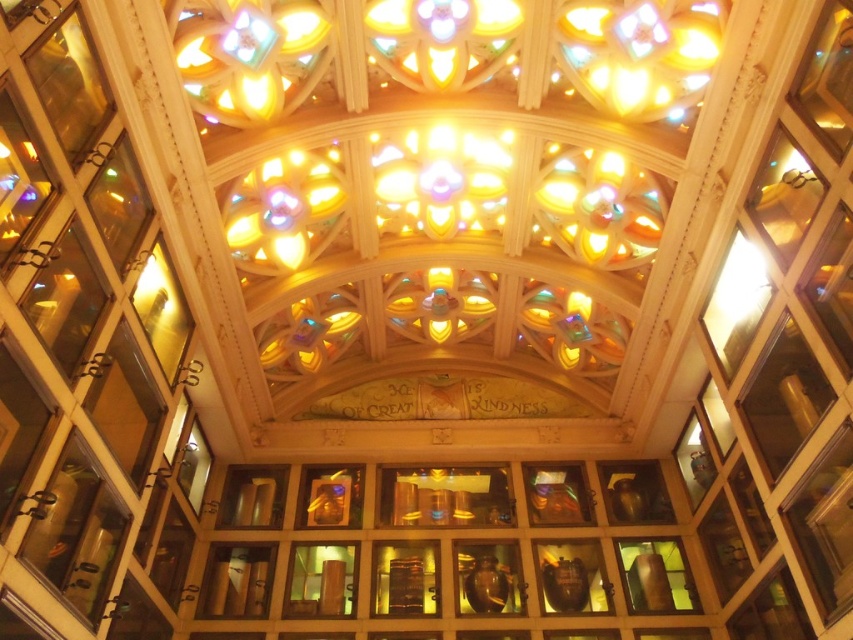
You are an interior designer planning to place a new rectangular table in this space. The table must be placed between the transparent wooden cabinet at center and the transparent glass vase at lower right. Given their widths, which object should the table be closer to to ensure it fits properly?

The transparent wooden cabinet at center is wider than the transparent glass vase at lower right. Therefore, the table should be placed closer to the transparent glass vase at lower right to accommodate the cabinet.

You are standing in the grand building and want to take a photo of both the stained glass windows and the inscription. You notice two points marked on the ceiling. One is at point (680, 596) and the other at point (170, 330). Which point should you stand closer to in order to ensure both the stained glass windows and the inscription are in your field of view?

You should stand closer to point (170, 330) because point (680, 596) is behind it, so moving towards the closer point allows you to see both the stained glass above and the inscription below.